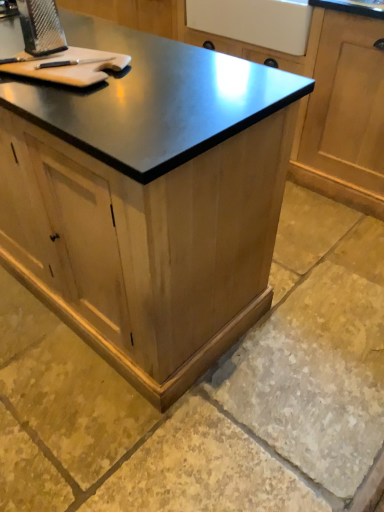
Question: Is the depth of wooden cabinet at center, which ranks as the second cabinetry in back-to-front order, greater than that of wooden cabinet at center, marked as the 1th cabinetry in a back-to-front arrangement?

Choices:
 (A) no
 (B) yes

Answer: (A)

Question: Can you confirm if wooden cabinet at center, which is the 1th cabinetry from front to back, is wider than wooden cabinet at center, arranged as the second cabinetry when viewed from the front?

Choices:
 (A) yes
 (B) no

Answer: (B)

Question: From a real-world perspective, is wooden cabinet at center, which ranks as the second cabinetry in back-to-front order, positioned over wooden cabinet at center, arranged as the second cabinetry when viewed from the front, based on gravity?

Choices:
 (A) no
 (B) yes

Answer: (B)

Question: Is wooden cabinet at center, arranged as the second cabinetry when viewed from the front, inside wooden cabinet at center, which is the 1th cabinetry from front to back?

Choices:
 (A) no
 (B) yes

Answer: (A)

Question: Does wooden cabinet at center, which is the 1th cabinetry from front to back, appear on the left side of wooden cabinet at center, arranged as the second cabinetry when viewed from the front?

Choices:
 (A) no
 (B) yes

Answer: (B)

Question: From the image's perspective, is light brown wood cutting board at upper left located above or below wooden cabinet at center, which ranks as the second cabinetry in back-to-front order?

Choices:
 (A) below
 (B) above

Answer: (B)

Question: Is light brown wood cutting board at upper left situated inside wooden cabinet at center, which is the 1th cabinetry from front to back, or outside?

Choices:
 (A) outside
 (B) inside

Answer: (B)

Question: In the image, is light brown wood cutting board at upper left positioned in front of or behind wooden cabinet at center, which is the 1th cabinetry from front to back?

Choices:
 (A) front
 (B) behind

Answer: (B)

Question: Is point (6, 64) positioned closer to the camera than point (82, 278)?

Choices:
 (A) farther
 (B) closer

Answer: (B)

Question: In terms of height, does natural stone floor at lower center look taller or shorter compared to wooden cabinet at center, marked as the 1th cabinetry in a back-to-front arrangement?

Choices:
 (A) short
 (B) tall

Answer: (A)

Question: Considering the positions of point [288, 248] and point [311, 161], is point [288, 248] closer or farther from the camera than point [311, 161]?

Choices:
 (A) farther
 (B) closer

Answer: (B)

Question: Is natural stone floor at lower center in front of or behind wooden cabinet at center, arranged as the second cabinetry when viewed from the front, in the image?

Choices:
 (A) front
 (B) behind

Answer: (A)

Question: From a real-world perspective, is natural stone floor at lower center positioned above or below wooden cabinet at center, arranged as the second cabinetry when viewed from the front?

Choices:
 (A) above
 (B) below

Answer: (B)

Question: From a real-world perspective, relative to wooden cabinet at center, arranged as the second cabinetry when viewed from the front, is light brown wood cutting board at upper left vertically above or below?

Choices:
 (A) below
 (B) above

Answer: (B)

Question: Is point (72, 48) closer or farther from the camera than point (84, 1)?

Choices:
 (A) farther
 (B) closer

Answer: (B)